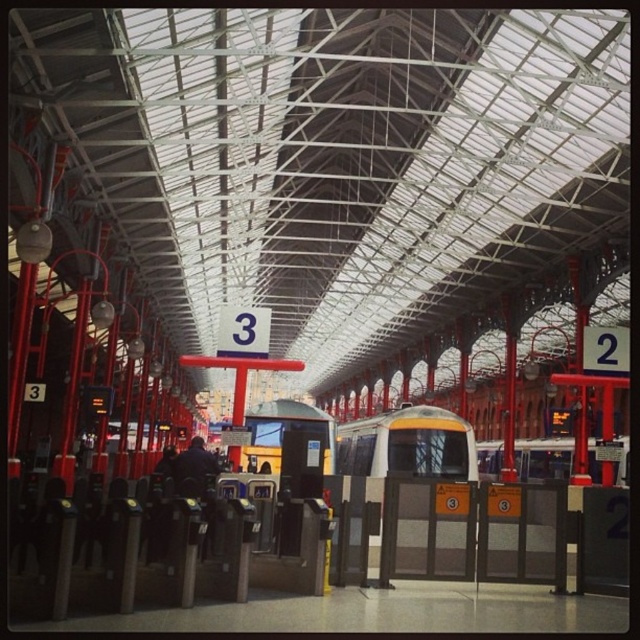
Question: Which point is closer to the camera?

Choices:
 (A) yellow metallic train at center
 (B) yellow and white train at center

Answer: (B)

Question: Can you confirm if yellow and white train at center is positioned above yellow metallic train at center?

Choices:
 (A) yes
 (B) no

Answer: (A)

Question: Is yellow and white train at center wider than yellow metallic train at center?

Choices:
 (A) no
 (B) yes

Answer: (A)

Question: Which point is farther to the camera?

Choices:
 (A) yellow and white train at center
 (B) yellow metallic train at center

Answer: (B)

Question: Does yellow and white train at center appear over yellow metallic train at center?

Choices:
 (A) yes
 (B) no

Answer: (A)